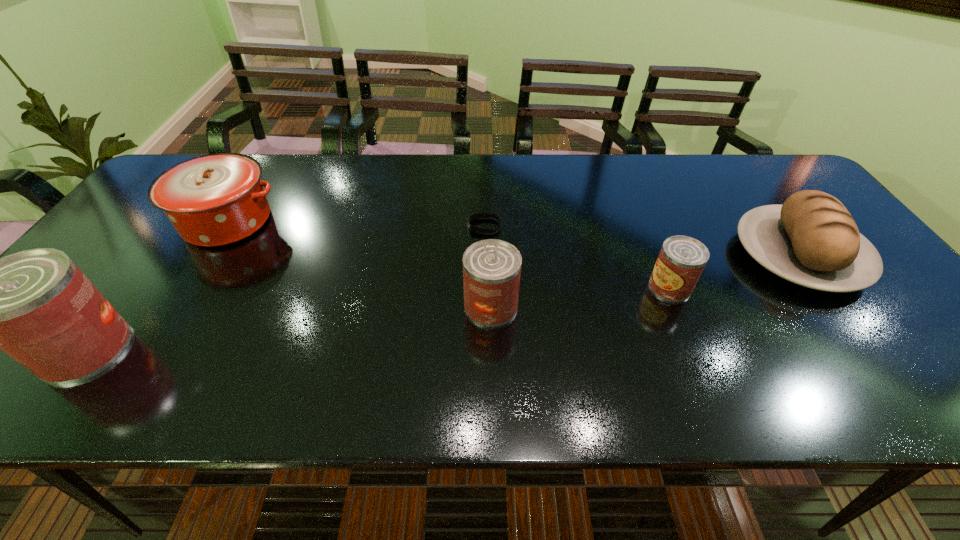
The height and width of the screenshot is (540, 960). Identify the location of the tallest can. (36, 305).

This screenshot has height=540, width=960. I want to click on the tallest object, so click(x=36, y=305).

You are a GUI agent. You are given a task and a screenshot of the screen. Output one action in this format:
    pyautogui.click(x=<x>, y=<y>)
    Task: Click on the second tallest can
    Image resolution: width=960 pixels, height=540 pixels.
    Given the screenshot: What is the action you would take?
    pyautogui.click(x=491, y=268)

The height and width of the screenshot is (540, 960). In order to click on the second shortest object in this screenshot , I will do `click(681, 260)`.

Locate an element on the screen. Image resolution: width=960 pixels, height=540 pixels. the second object from right to left is located at coordinates (681, 260).

The width and height of the screenshot is (960, 540). What are the coordinates of `casserole` in the screenshot? It's located at (213, 200).

Locate an element on the screen. the shortest object is located at coordinates (478, 215).

The image size is (960, 540). In order to click on bread in this screenshot , I will do `click(812, 240)`.

Locate an element on the screen. This screenshot has width=960, height=540. vacant point located on the back of the tallest object is located at coordinates (161, 248).

Find the location of a particular element. free location located on the right of the second can from left to right is located at coordinates (584, 306).